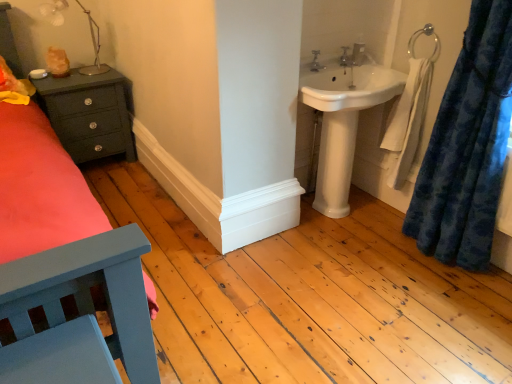
Question: Is matte silver tap at upper center, the second tap positioned from the left, taller than matte silver tap at upper center, the second tap viewed from the back?

Choices:
 (A) yes
 (B) no

Answer: (B)

Question: From a real-world perspective, is matte silver tap at upper center, which is the second tap from front to back, under matte silver tap at upper center, positioned as the 2th tap in right-to-left order?

Choices:
 (A) yes
 (B) no

Answer: (A)

Question: Can you confirm if matte silver tap at upper center, the second tap positioned from the left, is shorter than matte silver tap at upper center, positioned as the 2th tap in right-to-left order?

Choices:
 (A) no
 (B) yes

Answer: (B)

Question: Does matte silver tap at upper center, which is the second tap from front to back, appear on the left side of matte silver tap at upper center, the 1th tap positioned from the left?

Choices:
 (A) no
 (B) yes

Answer: (A)

Question: Is matte silver tap at upper center, which is the second tap from front to back, facing away from matte silver tap at upper center, the 1th tap positioned from the left?

Choices:
 (A) yes
 (B) no

Answer: (B)

Question: From a real-world perspective, is matte dark green nightstand at left positioned above or below silver metallic towel bar at upper right?

Choices:
 (A) above
 (B) below

Answer: (B)

Question: Considering the positions of matte dark green nightstand at left and silver metallic towel bar at upper right in the image, is matte dark green nightstand at left taller or shorter than silver metallic towel bar at upper right?

Choices:
 (A) short
 (B) tall

Answer: (B)

Question: Looking at their shapes, would you say matte dark green nightstand at left is wider or thinner than silver metallic towel bar at upper right?

Choices:
 (A) wide
 (B) thin

Answer: (A)

Question: Does point (81, 99) appear closer or farther from the camera than point (414, 51)?

Choices:
 (A) closer
 (B) farther

Answer: (B)

Question: From a real-world perspective, relative to matte dark green nightstand at left, is matte silver tap at upper center, the 1th tap from the front, vertically above or below?

Choices:
 (A) below
 (B) above

Answer: (B)

Question: Is matte silver tap at upper center, the 1th tap positioned from the left, spatially inside matte dark green nightstand at left, or outside of it?

Choices:
 (A) inside
 (B) outside

Answer: (B)

Question: Is matte silver tap at upper center, the 1th tap from the front, to the left or to the right of matte dark green nightstand at left in the image?

Choices:
 (A) left
 (B) right

Answer: (B)

Question: Is point (311, 67) positioned closer to the camera than point (112, 139)?

Choices:
 (A) farther
 (B) closer

Answer: (B)

Question: Is point (311, 54) positioned closer to the camera than point (392, 96)?

Choices:
 (A) closer
 (B) farther

Answer: (B)

Question: Is matte silver tap at upper center, positioned as the 2th tap in right-to-left order, to the left or to the right of white glossy sink at upper right in the image?

Choices:
 (A) right
 (B) left

Answer: (B)